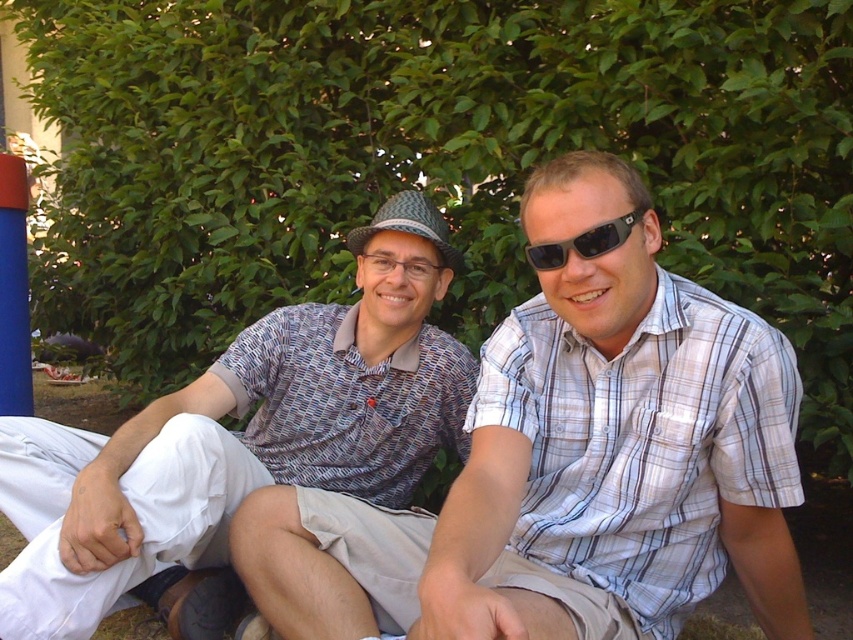
Question: Can you confirm if white cotton shirt at center is smaller than black plastic sunglasses at center?

Choices:
 (A) no
 (B) yes

Answer: (A)

Question: Which point is closer to the camera taking this photo?

Choices:
 (A) (378, 452)
 (B) (759, 435)
 (C) (537, 262)

Answer: (B)

Question: Is white cotton shirt at center to the left of black plastic sunglasses at center from the viewer's perspective?

Choices:
 (A) no
 (B) yes

Answer: (A)

Question: Which object is closer to the camera taking this photo?

Choices:
 (A) black plastic sunglasses at center
 (B) patterned fabric shirt at center

Answer: (A)

Question: Which of these objects is positioned closest to the patterned fabric shirt at center?

Choices:
 (A) black plastic sunglasses at center
 (B) white cotton shirt at center

Answer: (B)

Question: From the image, what is the correct spatial relationship of patterned fabric shirt at center in relation to black plastic sunglasses at center?

Choices:
 (A) right
 (B) left

Answer: (B)